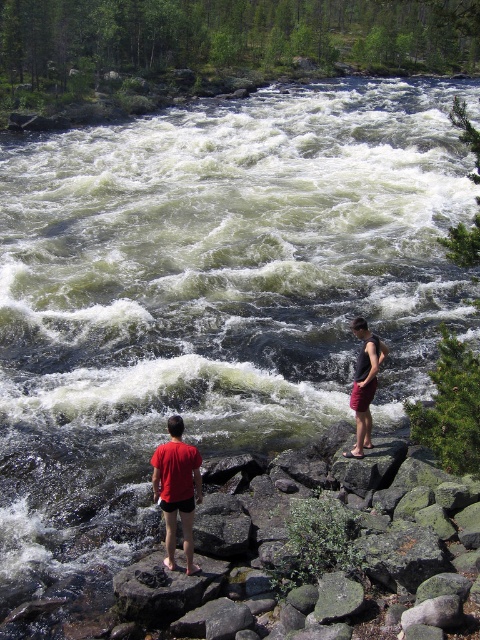
Based on the photo, can you confirm if matte red shorts at lower left is positioned below dark gray tank top at center?

Yes.

What do you see at coordinates (177, 490) in the screenshot? The image size is (480, 640). I see `matte red shorts at lower left` at bounding box center [177, 490].

The image size is (480, 640). I want to click on matte red shorts at lower left, so click(177, 490).

The height and width of the screenshot is (640, 480). I want to click on matte red shorts at lower left, so click(x=177, y=490).

Which is behind, point (181, 493) or point (369, 371)?

The point (369, 371) is more distant.

Identify the location of matte red shorts at lower left. (177, 490).

Looking at this image, does red fabric shorts at center have a lesser width compared to dark gray tank top at center?

Yes, red fabric shorts at center is thinner than dark gray tank top at center.

Can you confirm if red fabric shorts at center is positioned to the left of dark gray tank top at center?

Yes, red fabric shorts at center is to the left of dark gray tank top at center.

I want to click on red fabric shorts at center, so click(x=364, y=385).